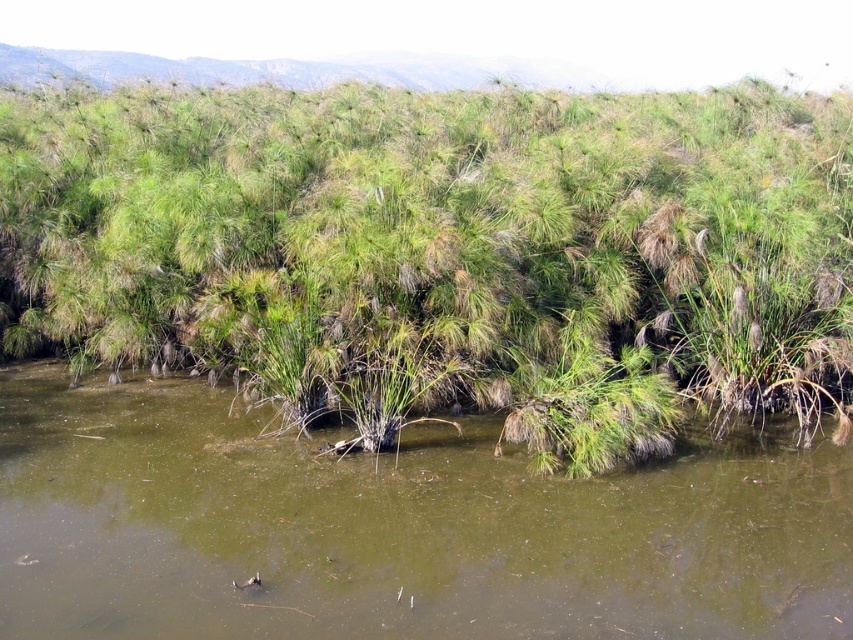
Based on the photo, is green grassy plant at center shorter than green muddy water at center?

No, green grassy plant at center is not shorter than green muddy water at center.

Who is higher up, green grassy plant at center or green muddy water at center?

→ green grassy plant at center is above.

Between point (253, 212) and point (78, 490), which one is positioned in front?

Point (78, 490)

At what (x,y) coordinates should I click in order to perform the action: click on green grassy plant at center. Please return your answer as a coordinate pair (x, y). The width and height of the screenshot is (853, 640). Looking at the image, I should click on (444, 252).